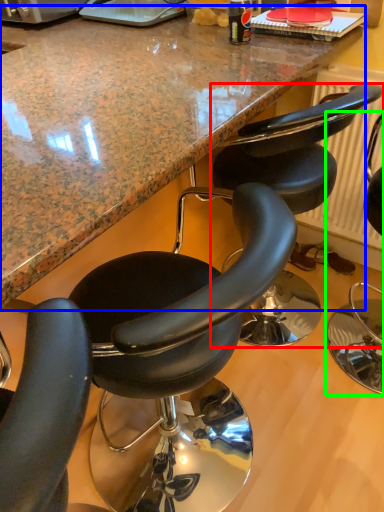
Question: Which object is the farthest from chair (highlighted by a red box)? Choose among these: countertop (highlighted by a blue box) or chair (highlighted by a green box).

Choices:
 (A) countertop
 (B) chair

Answer: (B)